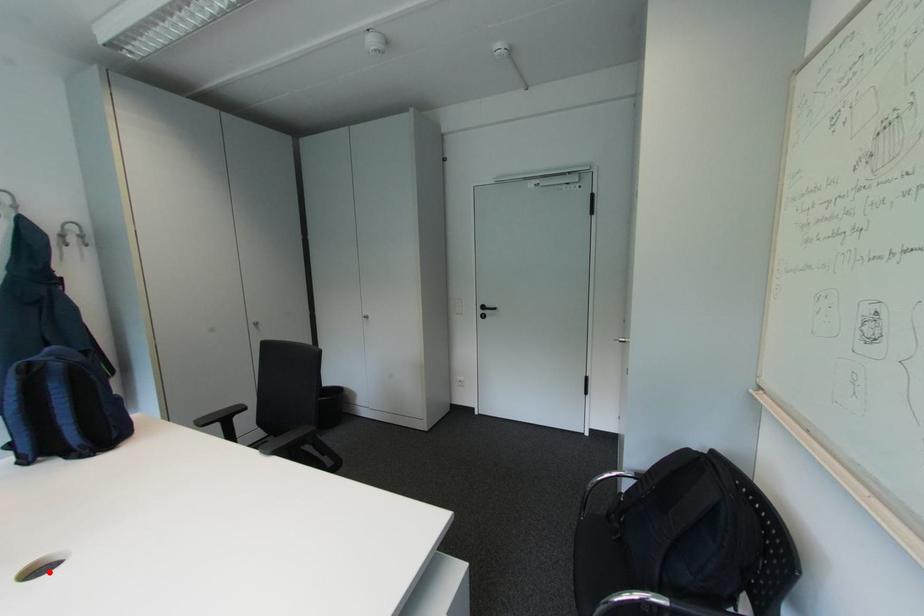
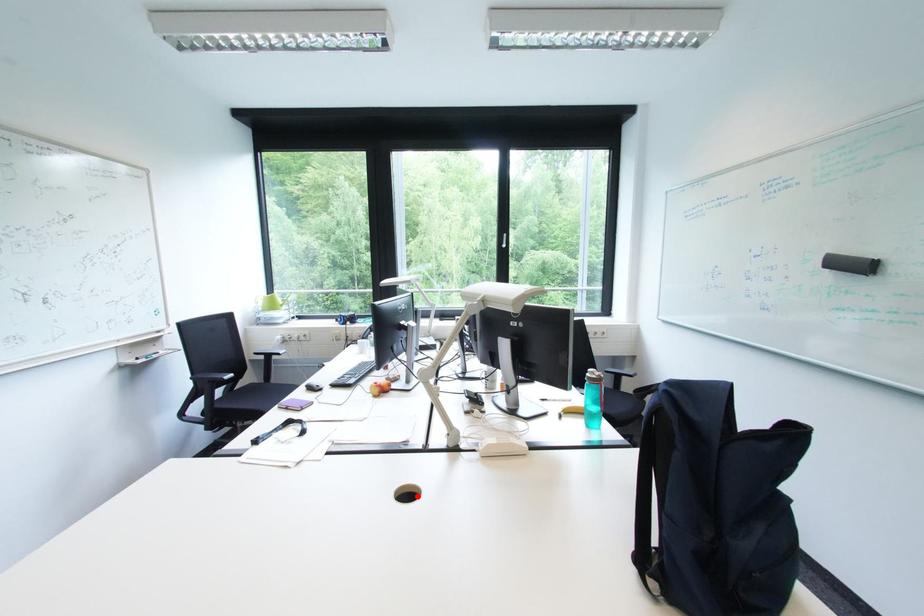
I am providing you with two images of the same scene from different viewpoints. A red point is marked on the first image and another point is marked on the second image. Is the marked point in image1 the same physical position as the marked point in image2?

Yes